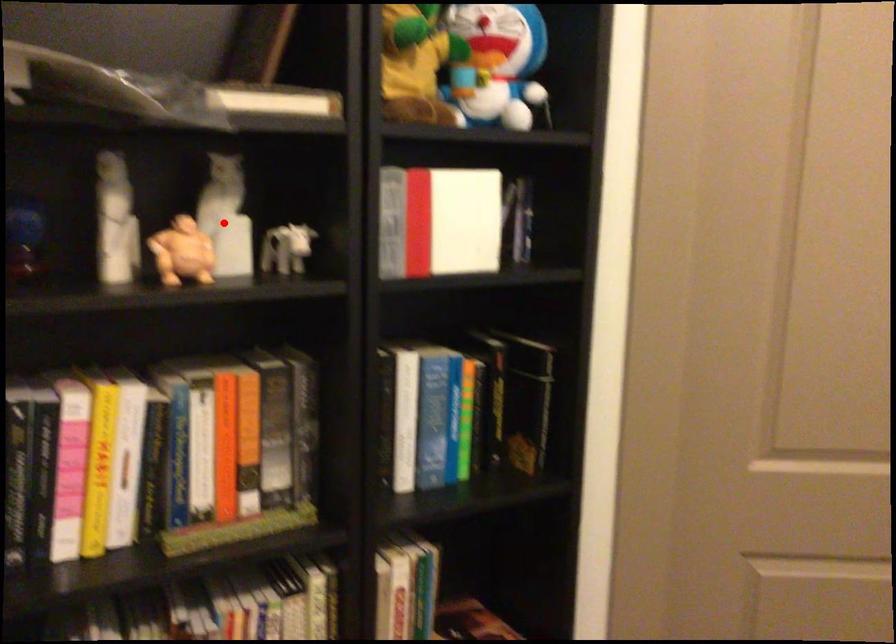
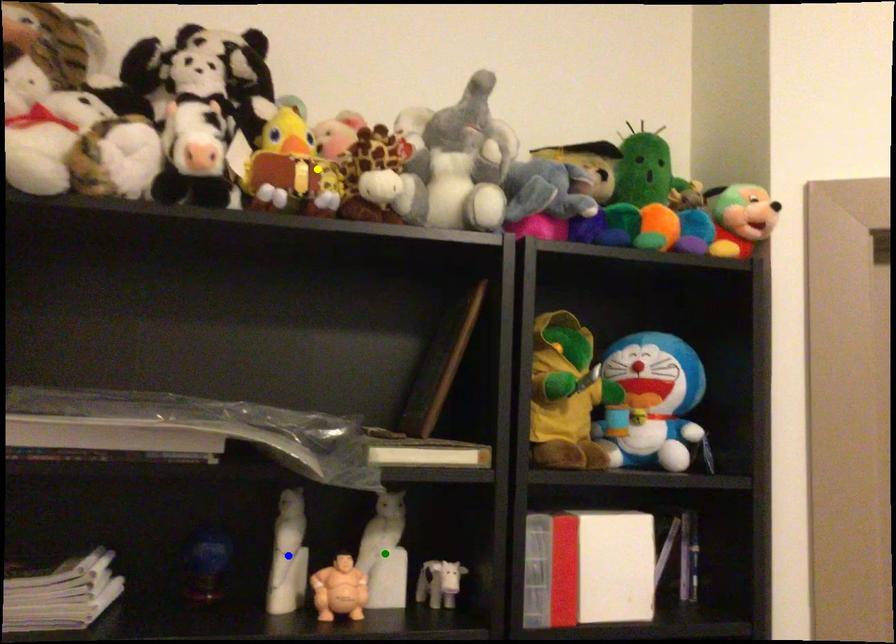
Question: I am providing you with two images of the same scene from different viewpoints. A red point is marked on the first image. You are given multiple points on the second image. Which point in image 2 is actually the same real-world point as the red point in image 1?

Choices:
 (A) yellow point
 (B) green point
 (C) blue point

Answer: (B)